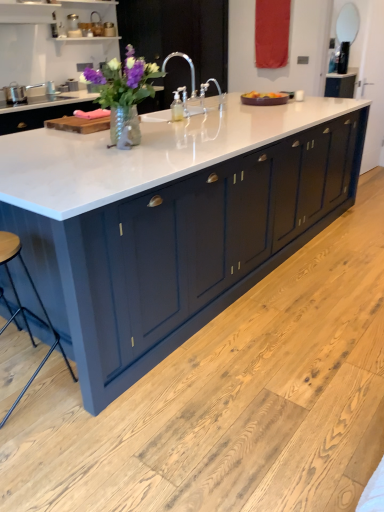
Question: Is point (104, 68) closer or farther from the camera than point (226, 33)?

Choices:
 (A) farther
 (B) closer

Answer: (B)

Question: From a real-world perspective, is matte glass vase at center above or below satin nickel faucet at center?

Choices:
 (A) below
 (B) above

Answer: (A)

Question: Which is nearer to the satin nickel faucet at center?

Choices:
 (A) matte silver mirror at upper right
 (B) white glossy sink at center
 (C) matte glass vase at center
 (D) wooden seat at lower left
 (E) white marble countertop at center

Answer: (B)

Question: Which of these objects is positioned farthest from the white glossy sink at center?

Choices:
 (A) white marble countertop at center
 (B) matte glass vase at center
 (C) wooden seat at lower left
 (D) matte silver mirror at upper right
 (E) satin nickel faucet at center

Answer: (C)